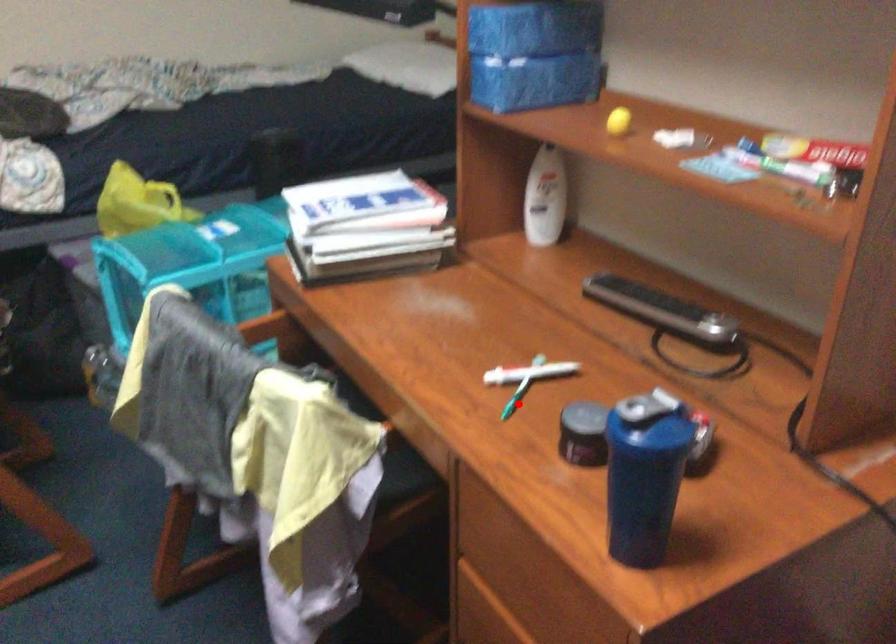
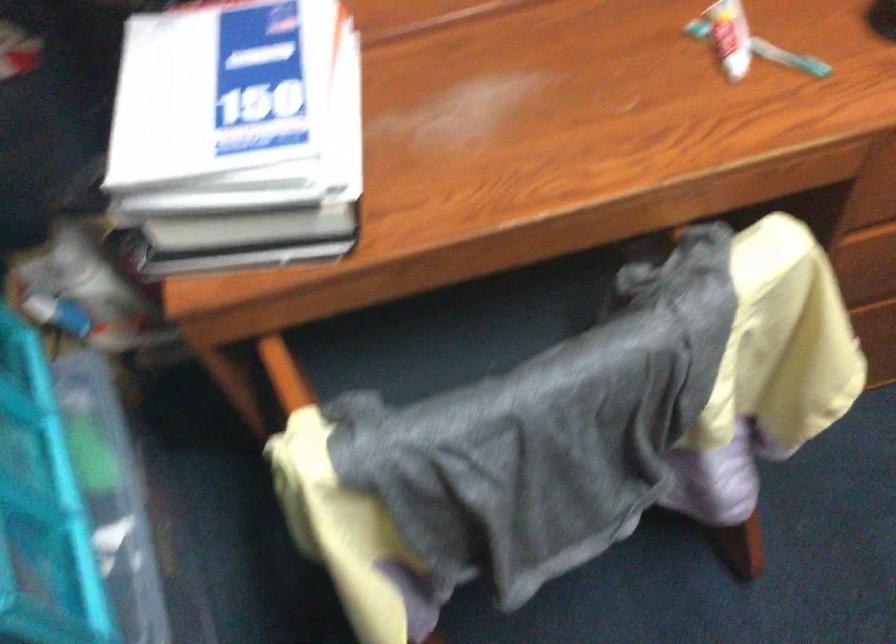
Question: A red point is marked in image1. In image2, is the corresponding 3D point closer to the camera or farther? Reply with the corresponding letter.

Choices:
 (A) The corresponding 3D point is closer.
 (B) The corresponding 3D point is farther.

Answer: (A)